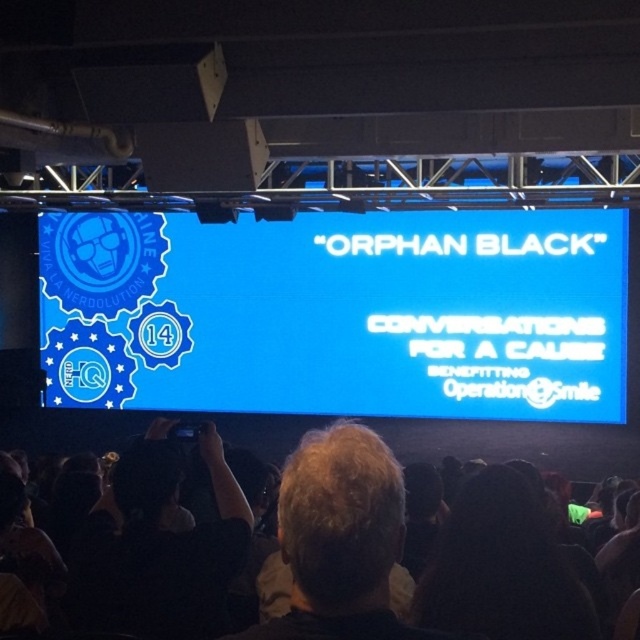
Between blue glossy screen at upper center and dark hair at center, which one is positioned lower?

dark hair at center is below.

Which of these two, blue glossy screen at upper center or dark hair at center, stands taller?

Standing taller between the two is blue glossy screen at upper center.

Is point (564, 403) positioned behind point (524, 541)?

Yes, point (564, 403) is behind point (524, 541).

In order to click on blue glossy screen at upper center in this screenshot , I will do `click(339, 314)`.

Does point (177, 220) come closer to viewer compared to point (620, 445)?

No, it is not.

Is blue glossy screen at upper center to the right of black fabric at lower center from the viewer's perspective?

Yes, blue glossy screen at upper center is to the right of black fabric at lower center.

What are the coordinates of `blue glossy screen at upper center` in the screenshot? It's located at (339, 314).

Where is `blue glossy screen at upper center`? blue glossy screen at upper center is located at coordinates click(339, 314).

Locate an element on the screen. This screenshot has height=640, width=640. dark hair at center is located at coordinates (500, 568).

I want to click on dark hair at center, so click(500, 568).